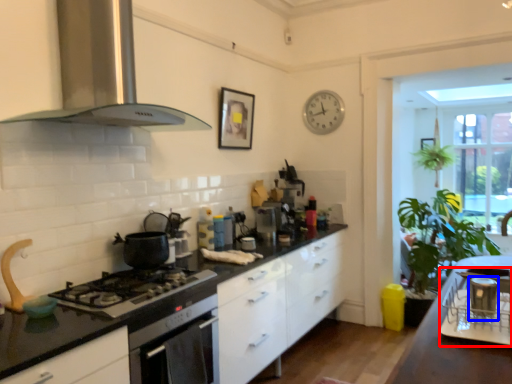
Question: Which point is further to the camera, appliance (highlighted by a red box) or appliance (highlighted by a blue box)?

Choices:
 (A) appliance
 (B) appliance

Answer: (B)